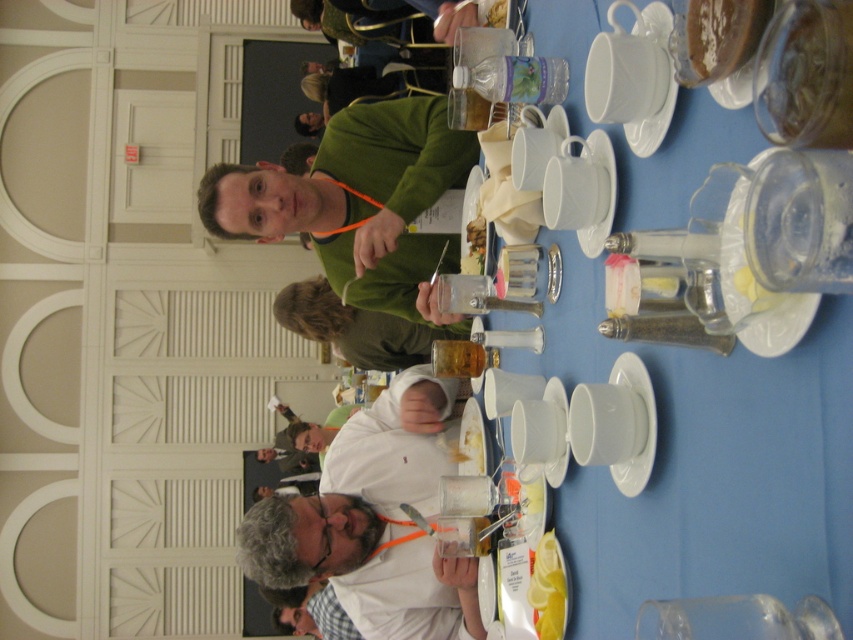
Measure the distance from matte green sweater at upper center to clear plastic container at right.

matte green sweater at upper center and clear plastic container at right are 5.42 meters apart.

Is matte green sweater at upper center wider than clear plastic container at right?

Yes, matte green sweater at upper center is wider than clear plastic container at right.

Is point (346, 321) closer to viewer compared to point (804, 328)?

No, (346, 321) is further to viewer.

You are a GUI agent. You are given a task and a screenshot of the screen. Output one action in this format:
    pyautogui.click(x=<x>, y=<y>)
    Task: Click on the matte green sweater at upper center
    
    Given the screenshot: What is the action you would take?
    pyautogui.click(x=357, y=326)

Between shiny brown sauce at upper right and yellow lemon at lower center, which one appears on the left side from the viewer's perspective?

yellow lemon at lower center

What are the coordinates of `shiny brown sauce at upper right` in the screenshot? It's located at (723, 35).

What are the coordinates of `shiny brown sauce at upper right` in the screenshot? It's located at (723, 35).

Can you confirm if shiny brown sauce at upper right is positioned above white ceramic plate at upper center?

Yes, shiny brown sauce at upper right is above white ceramic plate at upper center.

Is point (744, 1) farther from camera compared to point (601, 193)?

No, (744, 1) is in front of (601, 193).

Image resolution: width=853 pixels, height=640 pixels. Find the location of `shiny brown sauce at upper right`. shiny brown sauce at upper right is located at coordinates (723, 35).